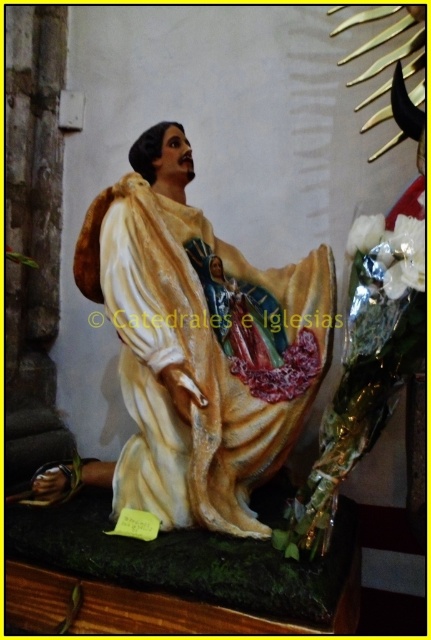
You are an art conservator examining the statue. You need to clean the white glossy robe at center and the white metallic flowers at center right. Which object is located lower on the statue?

The white glossy robe at center is positioned under the white metallic flowers at center right, so the robe is lower than the flowers.

You are standing in front of a religious statue in a church. You notice a point at coordinates (202, 355). What object is located at this point?

The white glossy robe at center is located at point (202, 355).